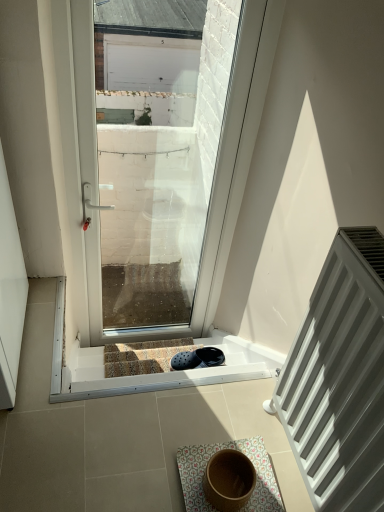
Question: Can you confirm if floral fabric bath mat at center is positioned to the left of transparent glass door at center?

Choices:
 (A) yes
 (B) no

Answer: (B)

Question: Is floral fabric bath mat at center far away from transparent glass door at center?

Choices:
 (A) no
 (B) yes

Answer: (B)

Question: From a real-world perspective, is floral fabric bath mat at center physically above transparent glass door at center?

Choices:
 (A) no
 (B) yes

Answer: (A)

Question: Does floral fabric bath mat at center have a greater width compared to transparent glass door at center?

Choices:
 (A) yes
 (B) no

Answer: (A)

Question: Is floral fabric bath mat at center further to camera compared to transparent glass door at center?

Choices:
 (A) yes
 (B) no

Answer: (B)

Question: Is floral fabric bath mat at center positioned beyond the bounds of transparent glass door at center?

Choices:
 (A) yes
 (B) no

Answer: (A)

Question: Is floral fabric bath mat at center to the left of white matte radiator at right from the viewer's perspective?

Choices:
 (A) no
 (B) yes

Answer: (B)

Question: Can you confirm if floral fabric bath mat at center is bigger than white matte radiator at right?

Choices:
 (A) no
 (B) yes

Answer: (A)

Question: Is the depth of floral fabric bath mat at center greater than that of white matte radiator at right?

Choices:
 (A) no
 (B) yes

Answer: (B)

Question: Is floral fabric bath mat at center at the right side of white matte radiator at right?

Choices:
 (A) yes
 (B) no

Answer: (B)

Question: Is floral fabric bath mat at center far away from white matte radiator at right?

Choices:
 (A) no
 (B) yes

Answer: (A)

Question: Is floral fabric bath mat at center taller than white matte radiator at right?

Choices:
 (A) yes
 (B) no

Answer: (B)

Question: Is white matte radiator at right positioned behind carpeted stairs at center?

Choices:
 (A) no
 (B) yes

Answer: (A)